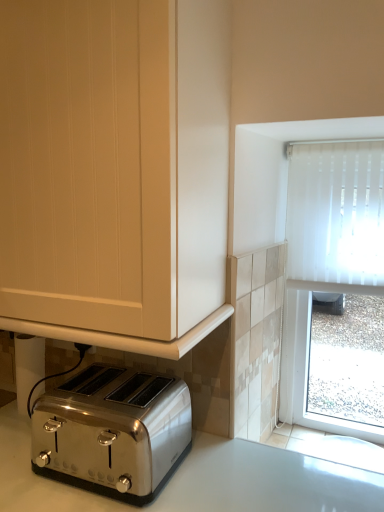
Identify the location of satin silver toaster at lower left. (113, 432).

What do you see at coordinates (113, 432) in the screenshot?
I see `satin silver toaster at lower left` at bounding box center [113, 432].

Locate an element on the screen. The width and height of the screenshot is (384, 512). matte white cabinet at lower left is located at coordinates [x=115, y=170].

What do you see at coordinates (115, 170) in the screenshot? I see `matte white cabinet at lower left` at bounding box center [115, 170].

Identify the location of satin silver toaster at lower left. (113, 432).

Between matte white cabinet at lower left and satin silver toaster at lower left, which one appears on the right side from the viewer's perspective?

From the viewer's perspective, satin silver toaster at lower left appears more on the right side.

Is matte white cabinet at lower left further to the viewer compared to satin silver toaster at lower left?

No, matte white cabinet at lower left is in front of satin silver toaster at lower left.

Which is further, (58, 69) or (164, 475)?

The point (164, 475) is farther from the camera.

From the image's perspective, is matte white cabinet at lower left located above or below satin silver toaster at lower left?

Clearly, from the image's perspective, matte white cabinet at lower left is above satin silver toaster at lower left.

From a real-world perspective, is matte white cabinet at lower left under satin silver toaster at lower left?

No.

Considering the sizes of objects matte white cabinet at lower left and satin silver toaster at lower left in the image provided, who is wider, matte white cabinet at lower left or satin silver toaster at lower left?

Wider between the two is matte white cabinet at lower left.

Can you confirm if matte white cabinet at lower left is taller than satin silver toaster at lower left?

Yes, matte white cabinet at lower left is taller than satin silver toaster at lower left.

Does matte white cabinet at lower left have a smaller size compared to satin silver toaster at lower left?

No.

Is matte white cabinet at lower left outside of satin silver toaster at lower left?

Yes.

Is matte white cabinet at lower left directly adjacent to satin silver toaster at lower left?

No, matte white cabinet at lower left is not in contact with satin silver toaster at lower left.

Could you tell me if matte white cabinet at lower left is facing satin silver toaster at lower left?

No, matte white cabinet at lower left is not oriented towards satin silver toaster at lower left.

Can you tell me how much matte white cabinet at lower left and satin silver toaster at lower left differ in facing direction?

The angle between the facing direction of matte white cabinet at lower left and the facing direction of satin silver toaster at lower left is 1.47 degrees.

Measure the distance from matte white cabinet at lower left to satin silver toaster at lower left.

The distance of matte white cabinet at lower left from satin silver toaster at lower left is 14.84 inches.

Where is `toaster beneath the matte white cabinet at lower left (from a real-world perspective)`? toaster beneath the matte white cabinet at lower left (from a real-world perspective) is located at coordinates coord(113,432).

Would you say satin silver toaster at lower left is to the left or to the right of matte white cabinet at lower left in the picture?

In the image, satin silver toaster at lower left appears on the right side of matte white cabinet at lower left.

Considering the positions of objects satin silver toaster at lower left and matte white cabinet at lower left in the image provided, who is in front, satin silver toaster at lower left or matte white cabinet at lower left?

matte white cabinet at lower left.

Is point (146, 416) more distant than point (52, 213)?

Yes, it is.

From the image's perspective, which is below, satin silver toaster at lower left or matte white cabinet at lower left?

satin silver toaster at lower left.

From a real-world perspective, between satin silver toaster at lower left and matte white cabinet at lower left, who is vertically lower?

From a 3D spatial view, satin silver toaster at lower left is below.

Can you confirm if satin silver toaster at lower left is wider than matte white cabinet at lower left?

No, satin silver toaster at lower left is not wider than matte white cabinet at lower left.

From their relative heights in the image, would you say satin silver toaster at lower left is taller or shorter than matte white cabinet at lower left?

satin silver toaster at lower left is shorter than matte white cabinet at lower left.

Is satin silver toaster at lower left bigger than matte white cabinet at lower left?

Incorrect, satin silver toaster at lower left is not larger than matte white cabinet at lower left.

Consider the image. Is satin silver toaster at lower left inside the boundaries of matte white cabinet at lower left, or outside?

satin silver toaster at lower left is spatially situated outside matte white cabinet at lower left.

Does satin silver toaster at lower left touch matte white cabinet at lower left?

No, satin silver toaster at lower left is not with matte white cabinet at lower left.

Is satin silver toaster at lower left facing towards matte white cabinet at lower left?

No.

Can you tell me how much satin silver toaster at lower left and matte white cabinet at lower left differ in facing direction?

They differ by 1.47 degrees in their facing directions.

Measure the distance between satin silver toaster at lower left and matte white cabinet at lower left.

14.84 inches.

At what (x,y) coordinates should I click in order to perform the action: click on toaster directly beneath the matte white cabinet at lower left (from a real-world perspective). Please return your answer as a coordinate pair (x, y). The image size is (384, 512). Looking at the image, I should click on (113, 432).

Image resolution: width=384 pixels, height=512 pixels. Find the location of `cabinetry on the left of satin silver toaster at lower left`. cabinetry on the left of satin silver toaster at lower left is located at coordinates (115, 170).

Where is `toaster below the matte white cabinet at lower left (from a real-world perspective)`? The width and height of the screenshot is (384, 512). toaster below the matte white cabinet at lower left (from a real-world perspective) is located at coordinates (113, 432).